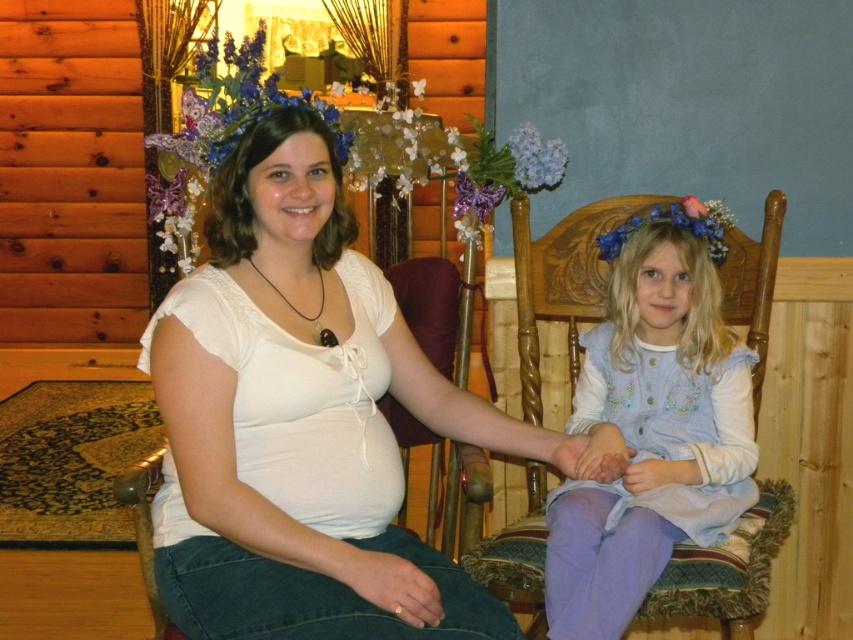
Can you confirm if white lace shirt at center is bigger than light blue fabric dress at center?

Indeed, white lace shirt at center has a larger size compared to light blue fabric dress at center.

Which is more to the right, white lace shirt at center or light blue fabric dress at center?

light blue fabric dress at center is more to the right.

Is point (573, 442) less distant than point (648, 282)?

Yes, it is.

Find the location of a particular element. white lace shirt at center is located at coordinates (303, 420).